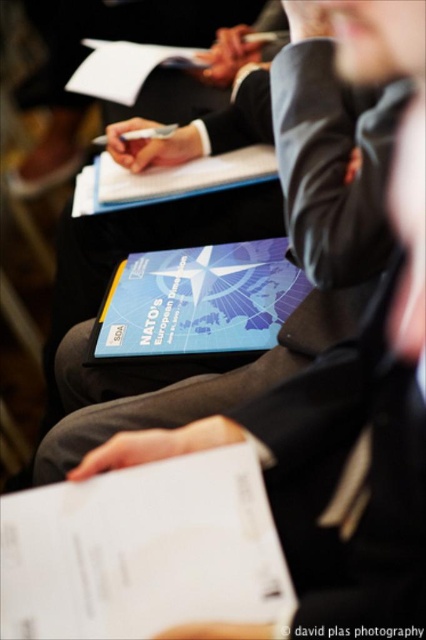
Question: Is dark gray wool business suit at center positioned before matte black pen at upper center?

Choices:
 (A) yes
 (B) no

Answer: (B)

Question: Among these points, which one is nearest to the camera?

Choices:
 (A) (252, 257)
 (B) (340, 624)
 (C) (259, 106)

Answer: (B)

Question: Which object is the farthest from the matte black pen at upper center?

Choices:
 (A) blue matte book at center
 (B) dark gray wool business suit at center

Answer: (A)

Question: Where is blue matte book at center located in relation to matte black pen at upper center in the image?

Choices:
 (A) above
 (B) below

Answer: (A)

Question: Among these points, which one is nearest to the camera?

Choices:
 (A) (307, 625)
 (B) (137, 321)
 (C) (328, 218)

Answer: (A)

Question: Does dark gray wool business suit at center lie behind matte black pen at upper center?

Choices:
 (A) yes
 (B) no

Answer: (A)